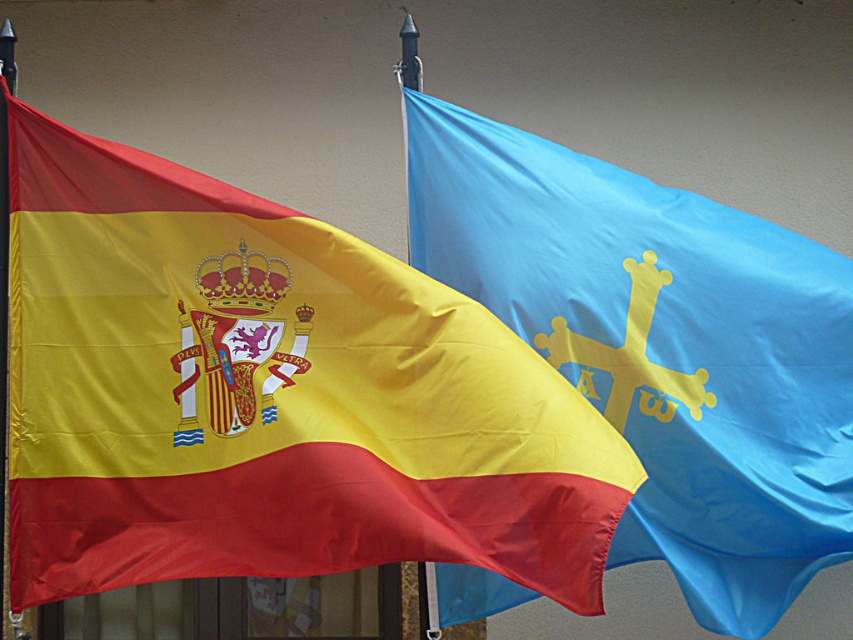
You are a decorator arranging items in a gallery. You have a matte fabric flag at left and a metallic pole at left. Based on the scene description, which object is positioned lower in the image?

The matte fabric flag at left is located below the metallic pole at left, so it is positioned lower in the image.

You are a visitor standing in front of two flags displayed against a beige wall. You notice the matte fabric flag at left and the matte blue flag with yellow cross at right. Which flag is closer to your left side?

The matte fabric flag at left is closer to your left side because it is positioned on the left side of the matte blue flag with yellow cross at right.

You are hanging two flags on a wall for an event. The matte fabric flag at left and the matte blue flag with yellow cross at right. Which flag has a greater width?

The matte fabric flag at left has a greater width than the matte blue flag with yellow cross at right.